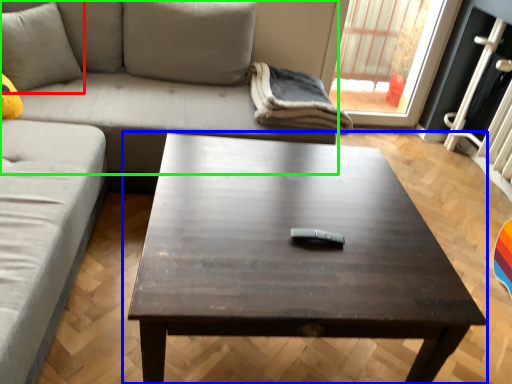
Question: Estimate the real-world distances between objects in this image. Which object is closer to pillow (highlighted by a red box), coffee table (highlighted by a blue box) or studio couch (highlighted by a green box)?

Choices:
 (A) coffee table
 (B) studio couch

Answer: (B)